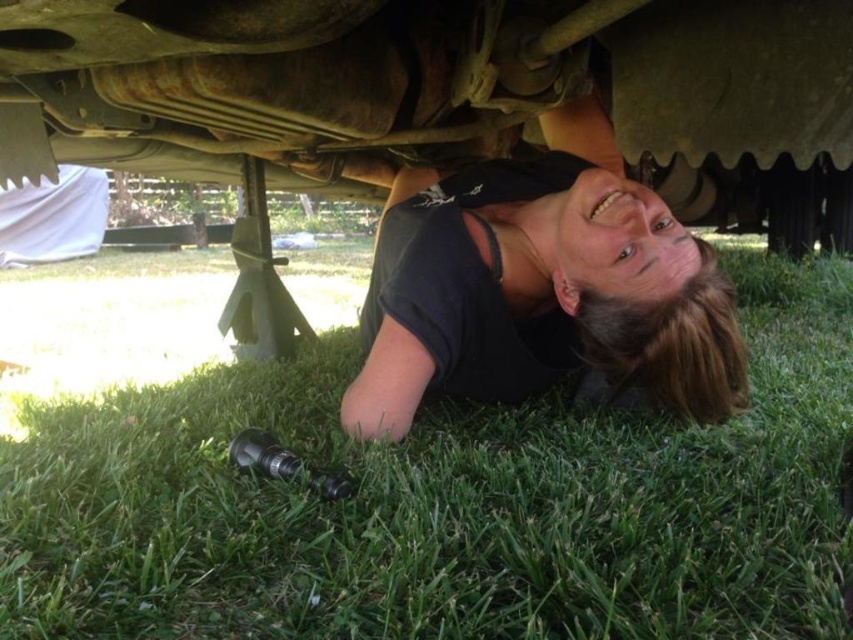
Question: Which object appears farthest from the camera in this image?

Choices:
 (A) black matte shirt at lower center
 (B) green grass at lower center

Answer: (A)

Question: Does green grass at lower center have a greater width compared to black matte shirt at lower center?

Choices:
 (A) yes
 (B) no

Answer: (A)

Question: Is the position of green grass at lower center more distant than that of black matte shirt at lower center?

Choices:
 (A) yes
 (B) no

Answer: (B)

Question: Is green grass at lower center to the right of black matte shirt at lower center from the viewer's perspective?

Choices:
 (A) no
 (B) yes

Answer: (B)

Question: Which point is farther from the camera taking this photo?

Choices:
 (A) (482, 365)
 (B) (788, 476)

Answer: (A)

Question: Which point is farther from the camera taking this photo?

Choices:
 (A) (531, 296)
 (B) (503, 636)

Answer: (A)